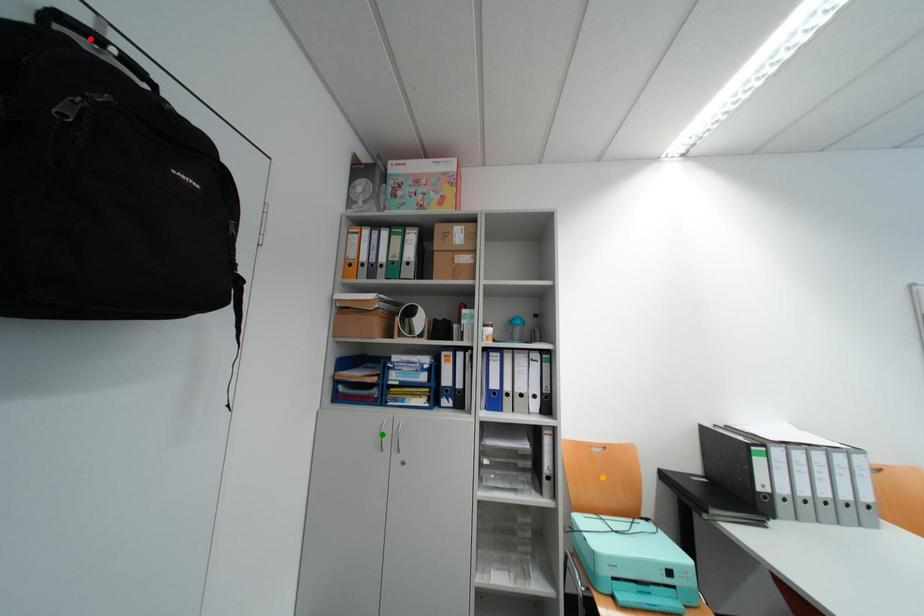
Order these from nearest to farthest:
- orange point
- green point
- red point

1. red point
2. green point
3. orange point